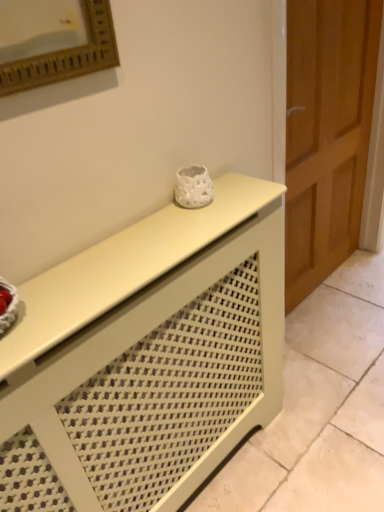
Image resolution: width=384 pixels, height=512 pixels. Identify the location of wooden door at right. (326, 134).

The width and height of the screenshot is (384, 512). Describe the element at coordinates (326, 134) in the screenshot. I see `wooden door at right` at that location.

Describe the element at coordinates (145, 358) in the screenshot. I see `matte white console table at center` at that location.

Where is `matte white console table at center`? This screenshot has width=384, height=512. matte white console table at center is located at coordinates tap(145, 358).

Image resolution: width=384 pixels, height=512 pixels. Find the location of `wooden door at right`. wooden door at right is located at coordinates (326, 134).

Which is more to the right, matte white console table at center or wooden door at right?

Positioned to the right is wooden door at right.

Does matte white console table at center lie in front of wooden door at right?

That is True.

Which is closer, (124, 237) or (341, 101)?

Point (124, 237)

From the image's perspective, which one is positioned lower, matte white console table at center or wooden door at right?

matte white console table at center appears lower in the image.

From a real-world perspective, which is physically above, matte white console table at center or wooden door at right?

wooden door at right, from a real-world perspective.

Is matte white console table at center wider than wooden door at right?

Correct, the width of matte white console table at center exceeds that of wooden door at right.

Considering the sizes of objects matte white console table at center and wooden door at right in the image provided, who is shorter, matte white console table at center or wooden door at right?

matte white console table at center is shorter.

Which of these two, matte white console table at center or wooden door at right, is smaller?

matte white console table at center.

Could wooden door at right be considered to be inside matte white console table at center?

Actually, wooden door at right is outside matte white console table at center.

Is matte white console table at center far from wooden door at right?

No, matte white console table at center is in close proximity to wooden door at right.

Is matte white console table at center aimed at wooden door at right?

No, matte white console table at center does not turn towards wooden door at right.

How different are the orientations of matte white console table at center and wooden door at right in degrees?

0.193 degrees separate the facing orientations of matte white console table at center and wooden door at right.

Where is `furniture below the wooden door at right (from the image's perspective)`? furniture below the wooden door at right (from the image's perspective) is located at coordinates (145, 358).

Considering the positions of objects wooden door at right and matte white console table at center in the image provided, who is more to the left, wooden door at right or matte white console table at center?

From the viewer's perspective, matte white console table at center appears more on the left side.

Is wooden door at right further to camera compared to matte white console table at center?

Yes, the depth of wooden door at right is greater than that of matte white console table at center.

Which is more distant, (305, 138) or (110, 344)?

Positioned behind is point (305, 138).

From the image's perspective, which one is positioned higher, wooden door at right or matte white console table at center?

wooden door at right.

From a real-world perspective, is wooden door at right positioned under matte white console table at center based on gravity?

No, from a real-world perspective, wooden door at right is not beneath matte white console table at center.

Between wooden door at right and matte white console table at center, which one has smaller width?

wooden door at right is thinner.

Can you confirm if wooden door at right is shorter than matte white console table at center?

In fact, wooden door at right may be taller than matte white console table at center.

Considering the relative sizes of wooden door at right and matte white console table at center in the image provided, is wooden door at right smaller than matte white console table at center?

No, wooden door at right is not smaller than matte white console table at center.

Is wooden door at right completely or partially outside of matte white console table at center?

Yes.

Are wooden door at right and matte white console table at center located far from each other?

No, wooden door at right is in close proximity to matte white console table at center.

Is matte white console table at center at the back of wooden door at right?

wooden door at right does not have its back to matte white console table at center.

What's the angular difference between wooden door at right and matte white console table at center's facing directions?

They differ by 0.193 degrees in their facing directions.

In the image, there is a matte white console table at center. At what (x,y) coordinates should I click in order to perform the action: click on door above it (from the image's perspective). Please return your answer as a coordinate pair (x, y). Looking at the image, I should click on (326, 134).

Find the location of a particular element. door above the matte white console table at center (from a real-world perspective) is located at coordinates (326, 134).

Find the location of a particular element. furniture lying on the left of wooden door at right is located at coordinates (145, 358).